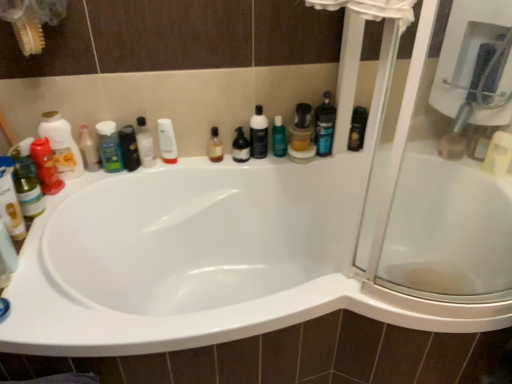
Question: From a real-world perspective, relative to white glossy lotion at upper center, acting as the 5th toiletry starting from the left, is matte red bottle at left, marked as the 1th cleaning product in a left-to-right arrangement, vertically above or below?

Choices:
 (A) below
 (B) above

Answer: (B)

Question: Considering the positions of point (74, 152) and point (161, 140), is point (74, 152) closer or farther from the camera than point (161, 140)?

Choices:
 (A) closer
 (B) farther

Answer: (A)

Question: Which of these objects is positioned closest to the transparent plastic bottle at upper center, the first cleaning product from the back?

Choices:
 (A) blue glossy bottle at upper right, the second toiletry in the right-to-left sequence
 (B) matte red shampoo at left, acting as the first toiletry starting from the left
 (C) translucent amber bottle at center, the 3th toiletry viewed from the right
 (D) matte red bottle at left, the 2th cleaning product viewed from the back
 (E) white glossy bottle at upper center, which is counted as the fifth toiletry, starting from the right

Answer: (A)

Question: Which is farther from the white glossy bottle at upper center, which is counted as the fifth toiletry, starting from the right?

Choices:
 (A) translucent plastic bottle at center, placed as the second mouthwash when sorted from left to right
 (B) translucent plastic bottle at left, which is the second toiletry from left to right
 (C) white glossy lotion at upper center, acting as the 5th toiletry starting from the left
 (D) matte red bottle at left, acting as the second cleaning product starting from the right
 (E) green matte shampoo at left, positioned as the 3th toiletry in left-to-right order

Answer: (A)